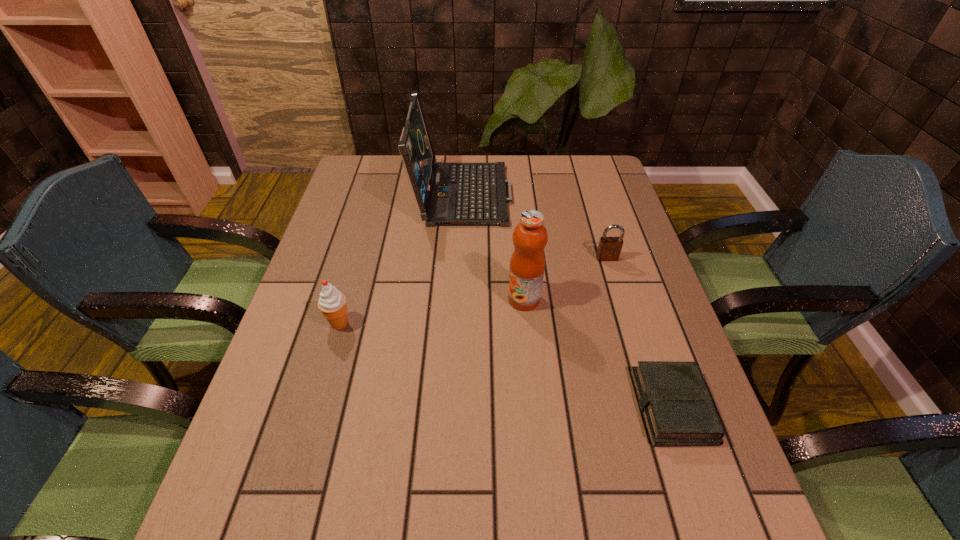
This screenshot has height=540, width=960. Find the location of `free space at the left edge of the desktop`. free space at the left edge of the desktop is located at coordinates (264, 381).

In the image, there is a desktop. Where is `free space at the right edge`? The image size is (960, 540). free space at the right edge is located at coordinates (606, 302).

This screenshot has height=540, width=960. In the image, there is a desktop. In order to click on vacant space at the far left corner in this screenshot , I will do pyautogui.click(x=355, y=176).

This screenshot has height=540, width=960. What are the coordinates of `vacant space at the far right corner of the desktop` in the screenshot? It's located at (610, 185).

Where is `free spot between the leftmost object and the padlock`? This screenshot has width=960, height=540. free spot between the leftmost object and the padlock is located at coordinates (473, 291).

This screenshot has height=540, width=960. I want to click on vacant space that is in between the padlock and the icecream, so click(x=473, y=291).

I want to click on free space between the second shortest object and the third nearest object, so click(x=565, y=279).

The height and width of the screenshot is (540, 960). I want to click on free spot between the nearest object and the third farthest object, so click(598, 353).

Find the location of a particular element. The image size is (960, 540). unoccupied area between the shortest object and the laptop computer is located at coordinates (567, 299).

The width and height of the screenshot is (960, 540). I want to click on unoccupied position between the icecream and the second shortest object, so click(473, 291).